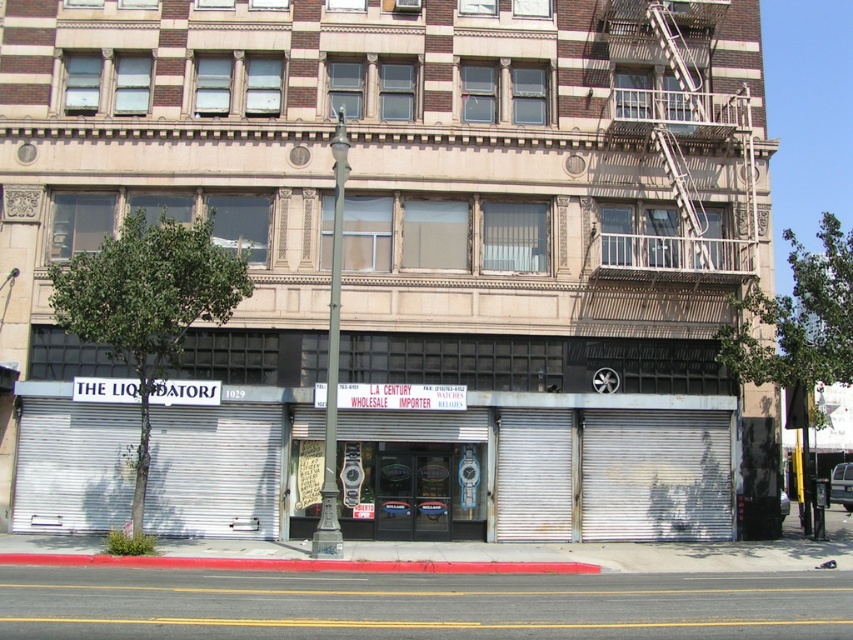
What is located at the point with coordinates (x=554, y=465) in the image?

At point (x=554, y=465) lies silver metallic shutters at center.

Based on the scene description, where are the silver metallic shutters at center located in the image?

The silver metallic shutters at center are located at point (554, 465) in the image.